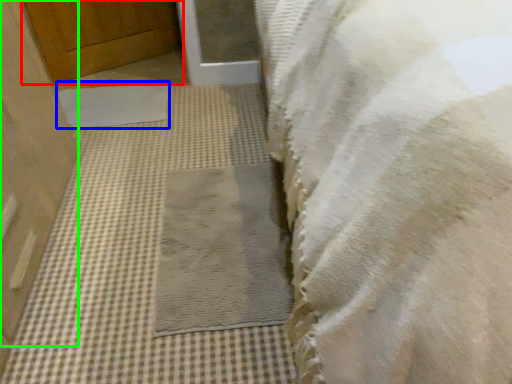
Question: Which is farther away from door (highlighted by a red box)? mat (highlighted by a blue box) or door (highlighted by a green box)?

Choices:
 (A) mat
 (B) door

Answer: (B)